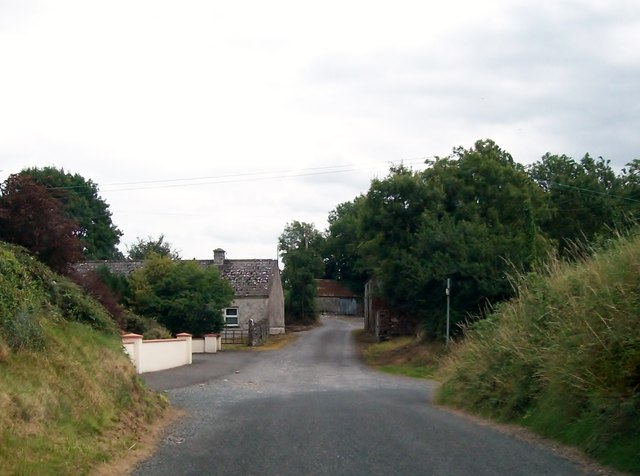
Image resolution: width=640 pixels, height=476 pixels. Find the location of `wall`. wall is located at coordinates (278, 308).